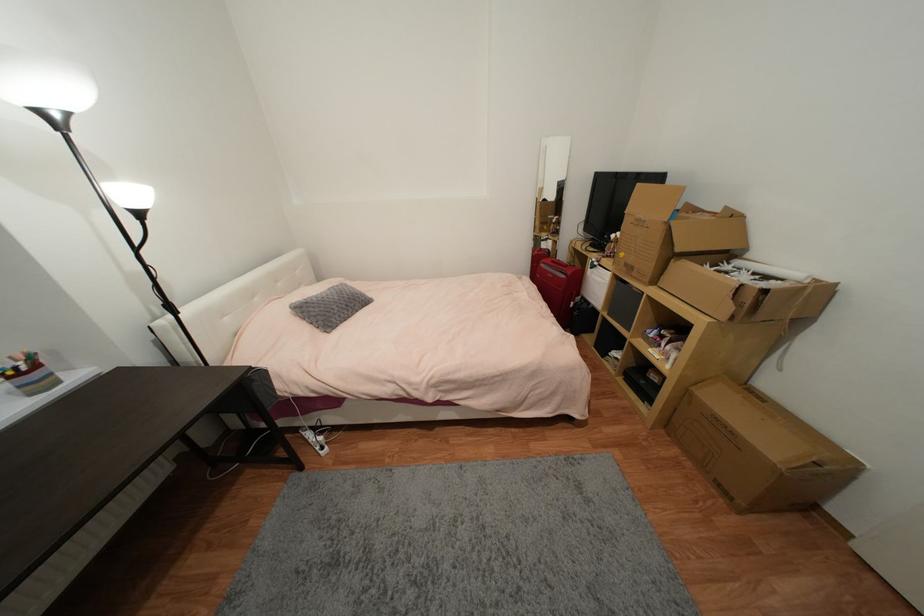
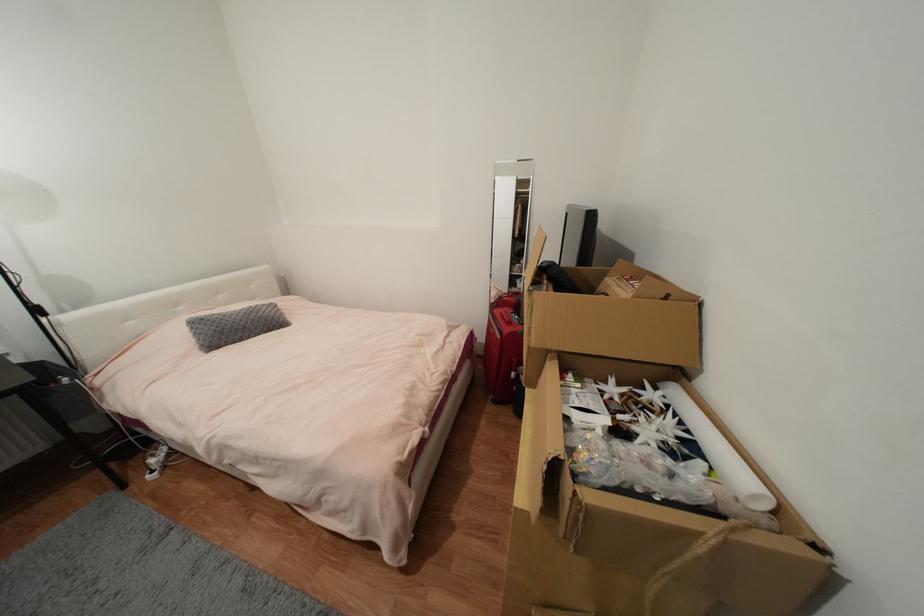
The point at (341, 299) is marked in the first image. Where is the corresponding point in the second image?

(244, 320)